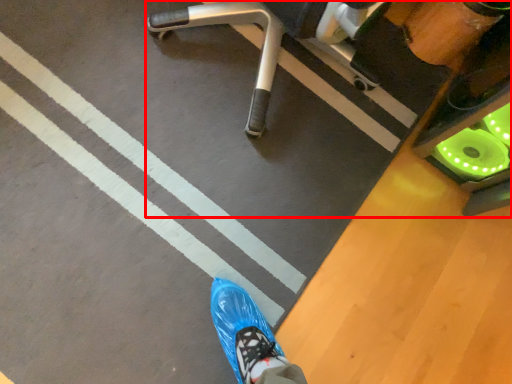
Question: In this image, where is furniture (annotated by the red box) located relative to strip?

Choices:
 (A) left
 (B) right

Answer: (B)